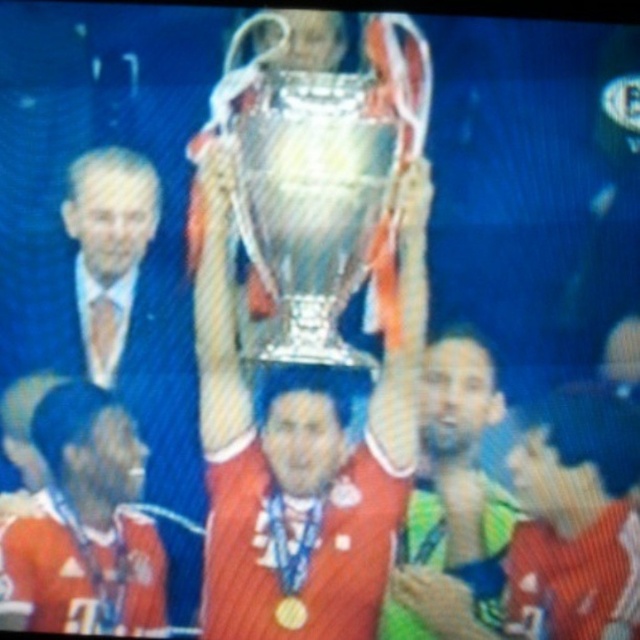
Is matte red jersey at center taller than smooth skin head at center?

Correct, matte red jersey at center is much taller as smooth skin head at center.

Which of these two, matte red jersey at center or smooth skin head at center, stands taller?

matte red jersey at center

Does point (90, 605) lie in front of point (461, 372)?

Yes.

I want to click on matte red jersey at center, so click(86, 524).

Is point (68, 236) in front of point (490, 364)?

Yes.

Is point (80, 220) behind point (472, 340)?

No, (80, 220) is in front of (472, 340).

The width and height of the screenshot is (640, 640). In order to click on white hair at left in this screenshot , I will do `click(112, 209)`.

From the picture: Is metallic trophy at center wider than shiny green jersey at center?

Correct, the width of metallic trophy at center exceeds that of shiny green jersey at center.

Is metallic trophy at center bigger than shiny green jersey at center?

Correct, metallic trophy at center is larger in size than shiny green jersey at center.

Is point (417, 314) in front of point (488, 508)?

That is False.

Locate an element on the screen. The width and height of the screenshot is (640, 640). metallic trophy at center is located at coordinates (301, 445).